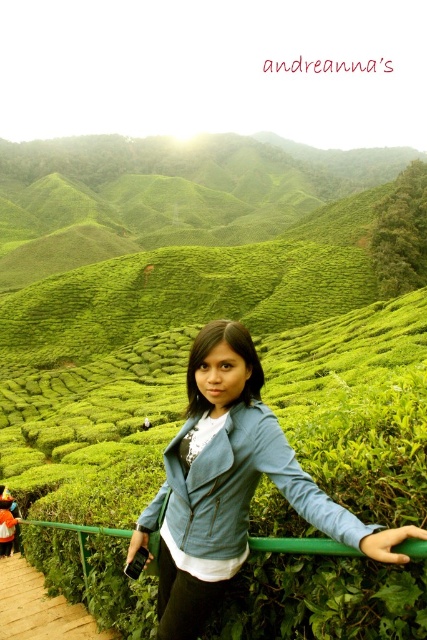
Question: Where is wooden planks at lower left located in relation to green metal/rail at center in the image?

Choices:
 (A) above
 (B) below

Answer: (B)

Question: Which object is farther from the camera taking this photo?

Choices:
 (A) wooden planks at lower left
 (B) matte blue jacket at center

Answer: (A)

Question: Is wooden planks at lower left to the left of green metal/rail at center from the viewer's perspective?

Choices:
 (A) yes
 (B) no

Answer: (A)

Question: Does matte blue jacket at center have a greater width compared to green metal/rail at center?

Choices:
 (A) no
 (B) yes

Answer: (A)

Question: Estimate the real-world distances between objects in this image. Which object is farther from the matte blue jacket at center?

Choices:
 (A) wooden planks at lower left
 (B) green metal/rail at center

Answer: (A)

Question: Considering the real-world distances, which object is closest to the green metal/rail at center?

Choices:
 (A) matte blue jacket at center
 (B) wooden planks at lower left

Answer: (A)